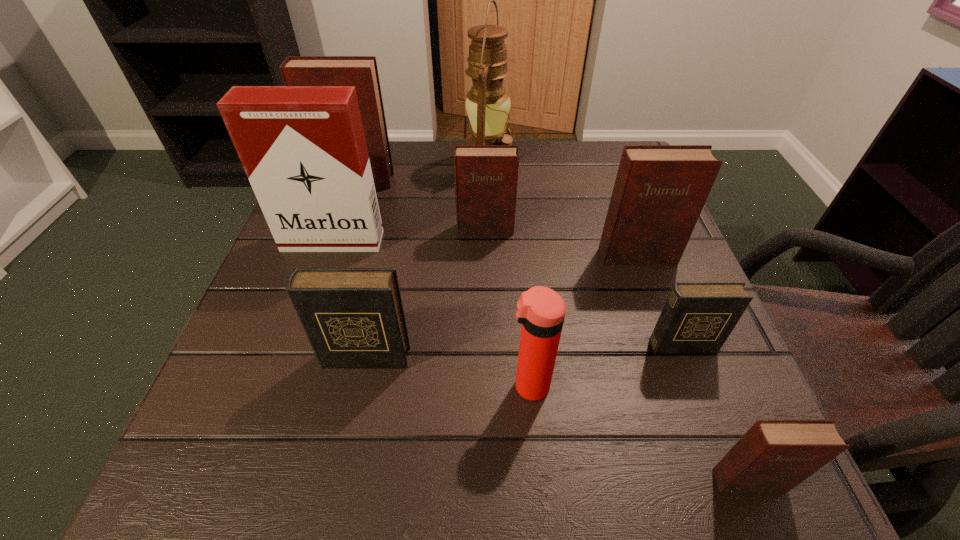
The height and width of the screenshot is (540, 960). Find the location of `oil lamp`. oil lamp is located at coordinates (488, 103).

At what (x,y) coordinates should I click in order to perform the action: click on red cigarette_case. Please return your answer as a coordinate pair (x, y). Image resolution: width=960 pixels, height=540 pixels. Looking at the image, I should click on (303, 148).

I want to click on the farthest reddish-brown diary, so click(360, 71).

This screenshot has width=960, height=540. In order to click on the leftmost reddish-brown diary in this screenshot , I will do `click(360, 71)`.

The width and height of the screenshot is (960, 540). I want to click on the fourth nearest diary, so click(x=660, y=190).

Where is `the third smallest reddish-brown diary`? The image size is (960, 540). the third smallest reddish-brown diary is located at coordinates (660, 190).

Where is `thermos bottle`? This screenshot has width=960, height=540. thermos bottle is located at coordinates (541, 311).

Where is `the fourth diary from right to left`? The height and width of the screenshot is (540, 960). the fourth diary from right to left is located at coordinates (486, 176).

This screenshot has height=540, width=960. I want to click on the third biggest reddish-brown diary, so click(486, 176).

Locate an element on the screen. The width and height of the screenshot is (960, 540). the left dark diary is located at coordinates (353, 317).